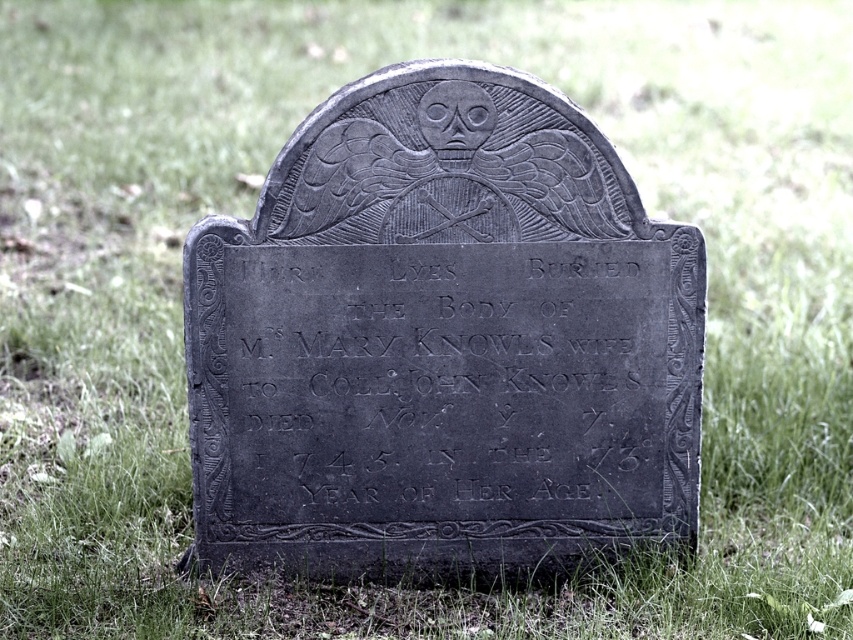
Question: Is black stone gravestone at center above black stone plaque at center?

Choices:
 (A) yes
 (B) no

Answer: (A)

Question: Which object appears farthest from the camera in this image?

Choices:
 (A) black stone plaque at center
 (B) black stone gravestone at center

Answer: (A)

Question: Is black stone gravestone at center smaller than black stone plaque at center?

Choices:
 (A) no
 (B) yes

Answer: (A)

Question: Is black stone gravestone at center further to camera compared to black stone plaque at center?

Choices:
 (A) no
 (B) yes

Answer: (A)